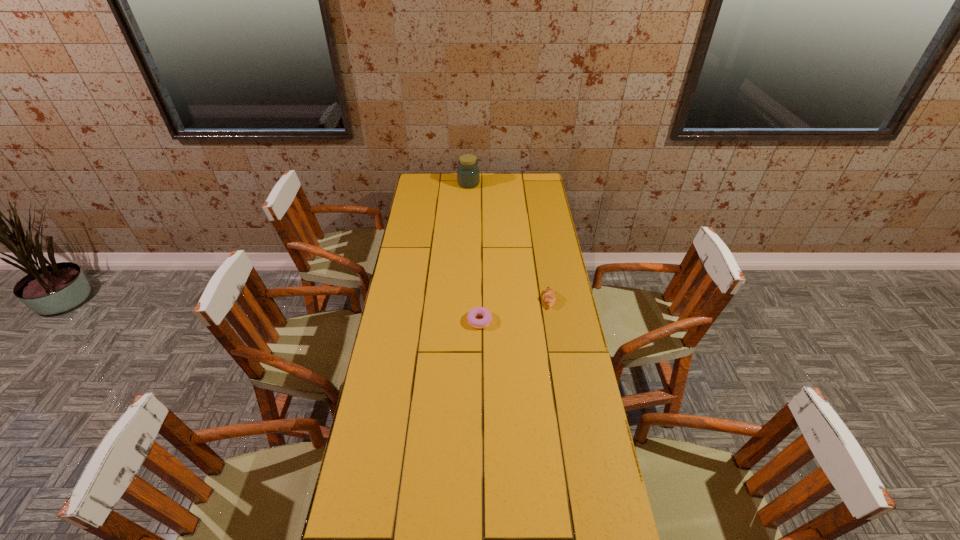
Find the location of `vacant region located 0.100m on the front of the nearer pastry`. vacant region located 0.100m on the front of the nearer pastry is located at coordinates (479, 351).

Find the location of `object that is at the far edge`. object that is at the far edge is located at coordinates point(468,175).

The image size is (960, 540). In order to click on object present at the right edge in this screenshot , I will do `click(549, 297)`.

The image size is (960, 540). In the image, there is a desktop. What are the coordinates of `free region at the far edge` in the screenshot? It's located at (455, 176).

Locate an element on the screen. vacant region at the left edge of the desktop is located at coordinates (378, 426).

The width and height of the screenshot is (960, 540). I want to click on free region at the right edge, so click(539, 294).

Where is `free space at the far left corner`? This screenshot has width=960, height=540. free space at the far left corner is located at coordinates (429, 174).

At what (x,y) coordinates should I click in order to perform the action: click on free space between the second farthest object and the farthest object. Please return your answer as a coordinate pair (x, y). Image resolution: width=960 pixels, height=540 pixels. Looking at the image, I should click on (509, 242).

Where is `free space that is in between the jar and the second nearest object`? Image resolution: width=960 pixels, height=540 pixels. free space that is in between the jar and the second nearest object is located at coordinates (509, 242).

Where is `free area in between the farther pastry and the nearer pastry`? The height and width of the screenshot is (540, 960). free area in between the farther pastry and the nearer pastry is located at coordinates (514, 310).